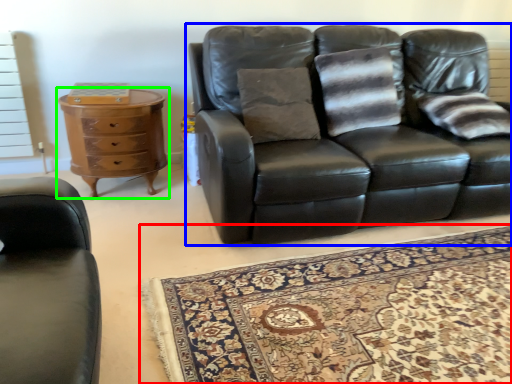
Question: Which object is the closest to the mat (highlighted by a red box)? Choose among these: studio couch (highlighted by a blue box) or chest of drawers (highlighted by a green box).

Choices:
 (A) studio couch
 (B) chest of drawers

Answer: (A)